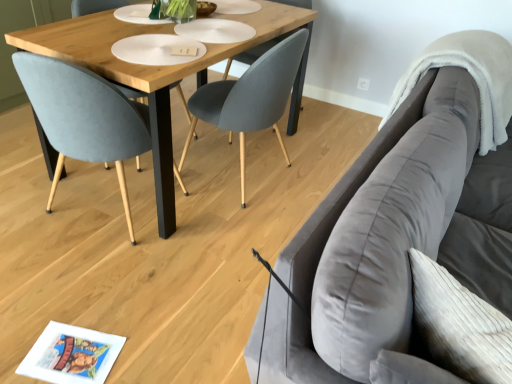
Locate an element on the screen. This screenshot has height=384, width=512. free space that is in between matte gray chair at center, which appears as the second chair when viewed from the left, and wooden table at center is located at coordinates (238, 204).